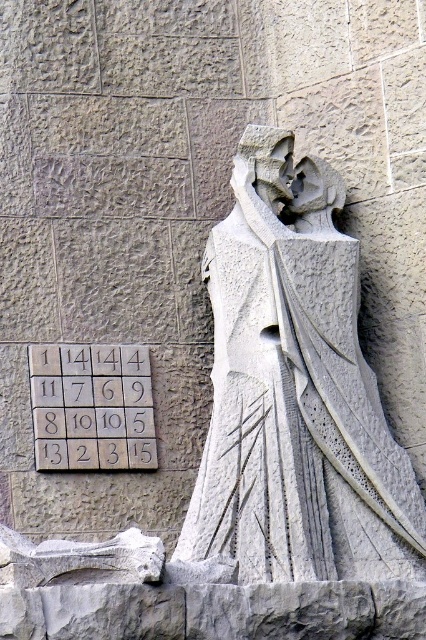
Question: Can you confirm if white stone statue at center is bigger than white stone tiles at center?

Choices:
 (A) no
 (B) yes

Answer: (B)

Question: Which point is farther from the camera taking this photo?

Choices:
 (A) (32, 394)
 (B) (299, 230)

Answer: (B)

Question: Which object appears closest to the camera in this image?

Choices:
 (A) white stone statue at center
 (B) white stone tiles at center

Answer: (A)

Question: Can you confirm if white stone statue at center is positioned to the right of white stone tiles at center?

Choices:
 (A) no
 (B) yes

Answer: (B)

Question: Is white stone statue at center below white stone tiles at center?

Choices:
 (A) yes
 (B) no

Answer: (B)